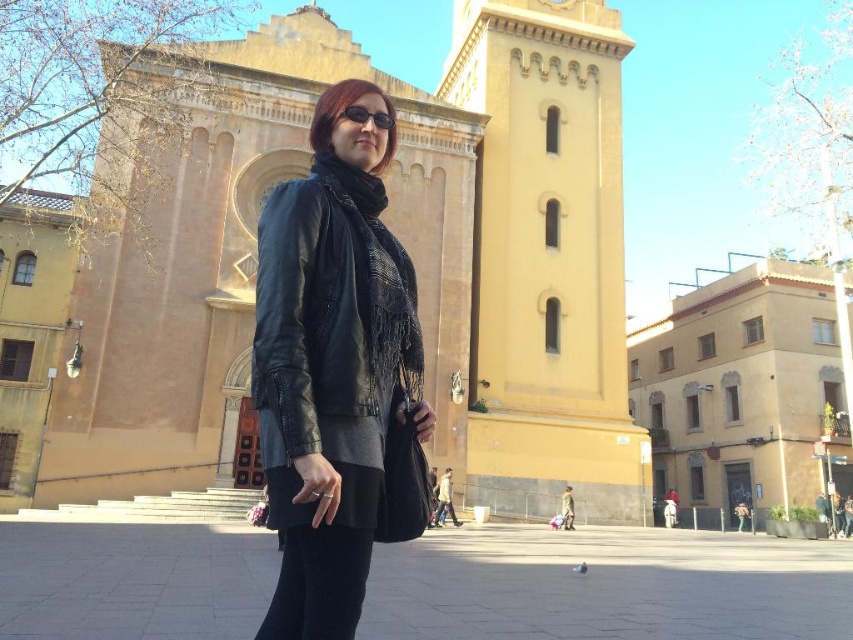
Question: Is matte yellow church at center to the right of black textured scarf at center from the viewer's perspective?

Choices:
 (A) yes
 (B) no

Answer: (A)

Question: Which of the following is the farthest from the observer?

Choices:
 (A) yellow matte tower at center
 (B) black textured scarf at center
 (C) black matte sunglasses at center

Answer: (A)

Question: Which object appears farthest from the camera in this image?

Choices:
 (A) black textured scarf at center
 (B) matte yellow church at center

Answer: (B)

Question: Which point appears closest to the camera in this image?

Choices:
 (A) (387, 124)
 (B) (357, 186)
 (C) (482, 404)
 (D) (480, 195)

Answer: (B)

Question: Can you confirm if matte yellow church at center is positioned below black matte sunglasses at center?

Choices:
 (A) yes
 (B) no

Answer: (A)

Question: Can you confirm if yellow matte tower at center is positioned above black textured scarf at center?

Choices:
 (A) yes
 (B) no

Answer: (A)